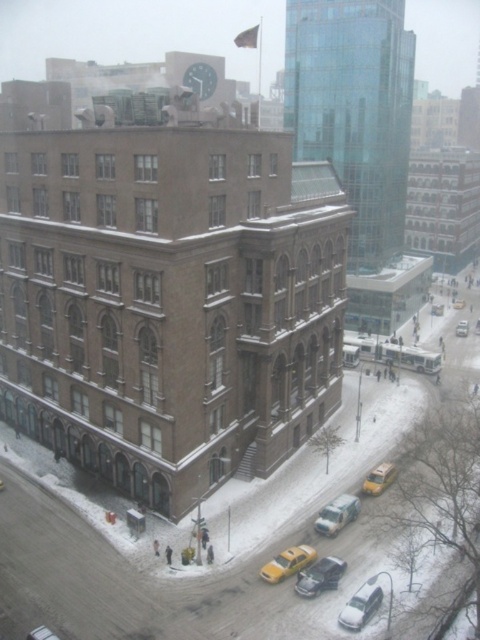
You are a delivery person needing to park your 5.5 meter long truck between the white glossy car at lower right and the metallic silver sedan at lower center. Can you fit your truck in the space between them?

The distance between the white glossy car at lower right and the metallic silver sedan at lower center is 8.33 meters. Since your truck is 5.5 meters long, there is enough space to park it between them.

You are standing at the corner of the street in front of the brownstone building and want to hail a taxi. The nearest taxi is the metallic silver sedan at lower center. If you walk straight towards the point at coordinates (336,515), will you reach the metallic silver sedan at lower center?

Yes, because the point at coordinates (336,515) corresponds to the metallic silver sedan at lower center.

You are a pedestrian standing at the crosswalk near the yellow matte taxi at lower center and the metallic silver sedan at lower center. Which vehicle is closer to you?

The yellow matte taxi at lower center is closer to you because it is positioned under the metallic silver sedan at lower center, indicating it is in front and nearer to your viewpoint.